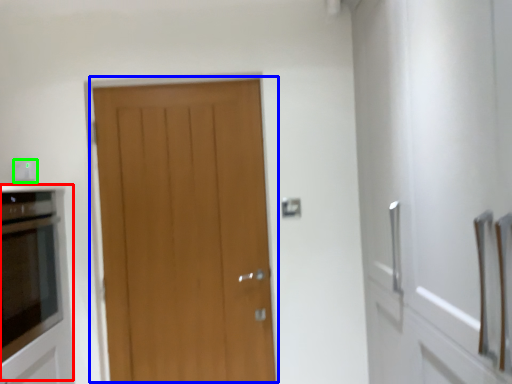
Question: Estimate the real-world distances between objects in this image. Which object is closer to appliance (highlighted by a red box), door (highlighted by a blue box) or electric outlet (highlighted by a green box)?

Choices:
 (A) door
 (B) electric outlet

Answer: (A)